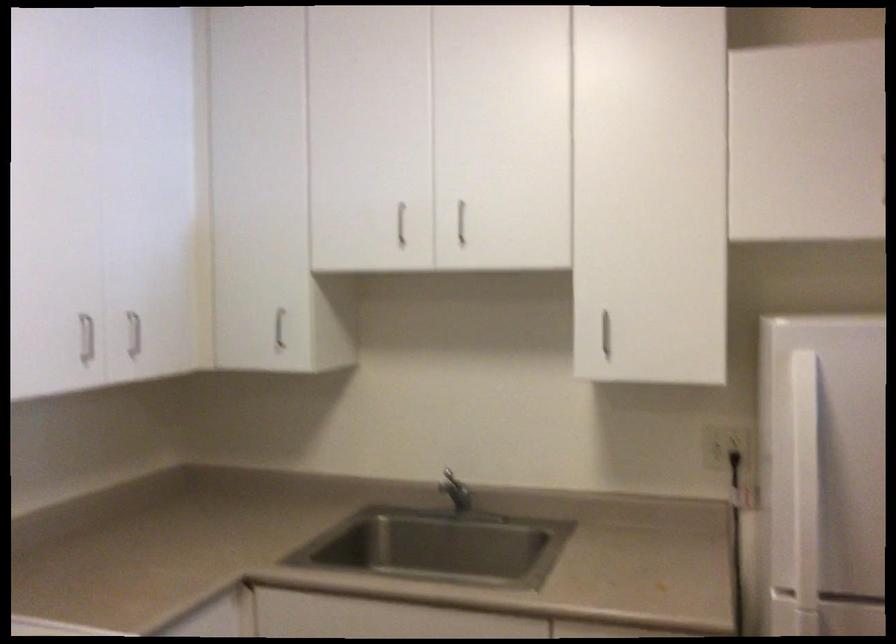
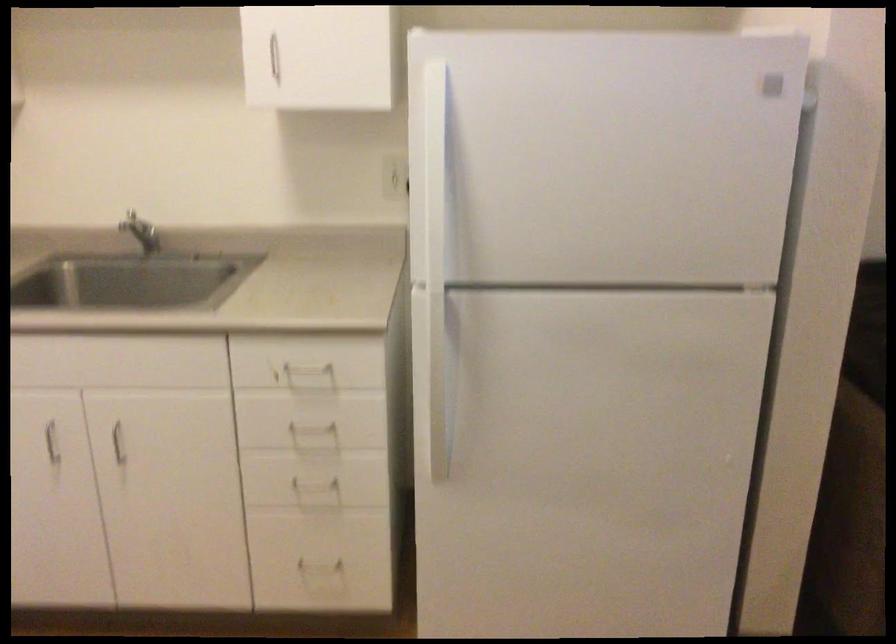
In the second image, find the point that corresponds to point 607,333 in the first image.

(270, 59)